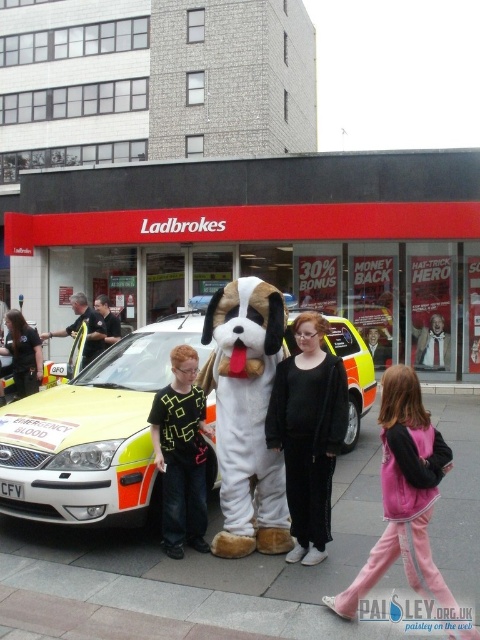
Looking at this image, you are a pedestrian standing on the sidewalk near the Ladbrokes shop. You see a furry white and brown dog at center and a dark blue uniform at left. Which object is taller?

The furry white and brown dog at center is taller than the dark blue uniform at left.

You are a delivery driver who needs to park your van near the Ladbrokes betting shop. The parking spot is marked by the point at coordinates (309, 440). Can you safely park your van there without blocking the emergency vehicle or the dog?

The point at coordinates (309, 440) indicates the location of the furry white and brown dog at center. Since the dog is occupying that spot, you cannot park there without disturbing it. Please choose another parking spot away from the emergency vehicle and the dog.